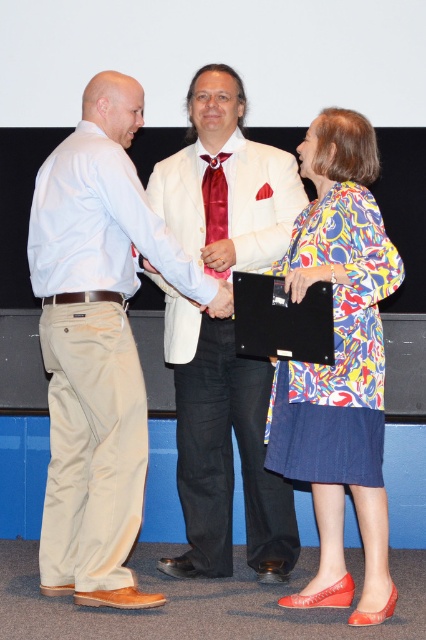
Question: Among these objects, which one is farthest from the camera?

Choices:
 (A) white satin suit at center
 (B) satin red tie at center

Answer: (B)

Question: Is white satin suit at center above satin red tie at center?

Choices:
 (A) yes
 (B) no

Answer: (B)

Question: Is khaki cotton pants at left bigger than white satin suit at center?

Choices:
 (A) yes
 (B) no

Answer: (A)

Question: Can you confirm if white satin suit at center is wider than satin red tie at center?

Choices:
 (A) no
 (B) yes

Answer: (B)

Question: Which point is farther to the camera?

Choices:
 (A) (127, 212)
 (B) (238, 445)
 (C) (337, 225)

Answer: (B)

Question: Which object is positioned closest to the printed silk blouse at center?

Choices:
 (A) white satin suit at center
 (B) khaki cotton pants at left

Answer: (A)